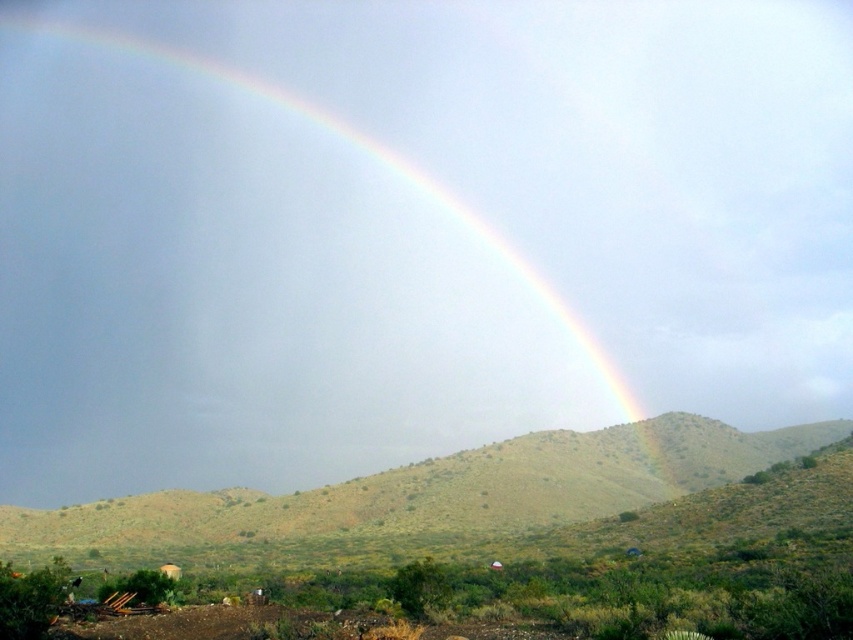
Between point (189, 340) and point (231, 552), which one is positioned behind?

The point (189, 340) is behind.

Does point (583, 348) come in front of point (32, 548)?

No, it is behind (32, 548).

Where is `rainbow at upper center`? This screenshot has width=853, height=640. rainbow at upper center is located at coordinates (244, 289).